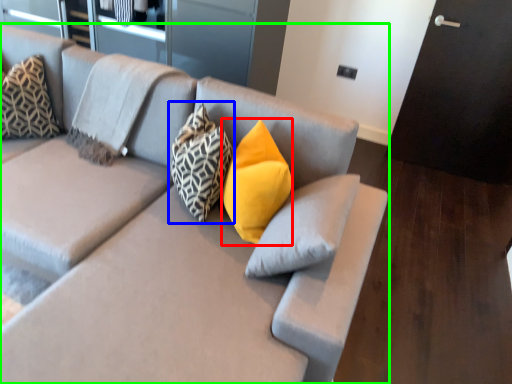
Question: Which is farther away from pillow (highlighted by a red box)? pillow (highlighted by a blue box) or studio couch (highlighted by a green box)?

Choices:
 (A) pillow
 (B) studio couch

Answer: (B)